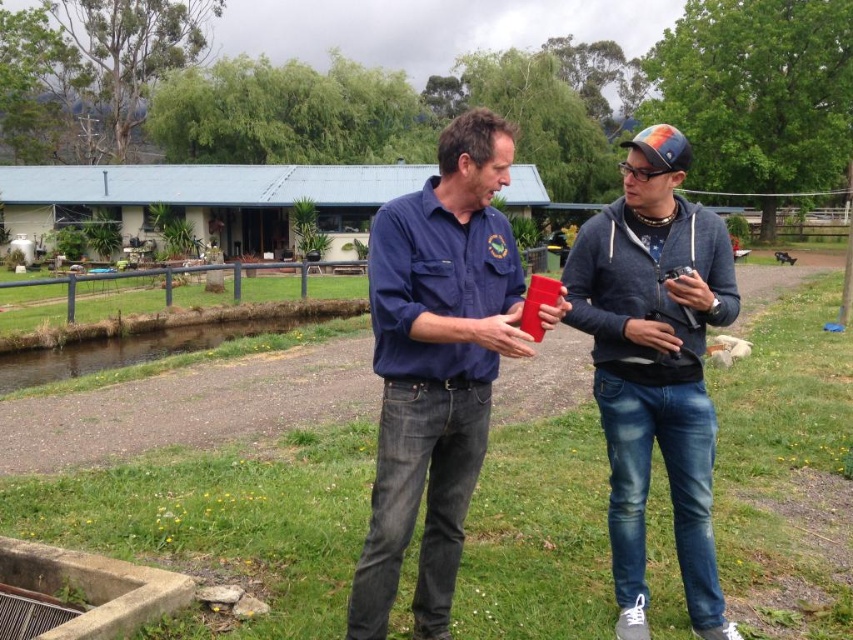
Question: Which of the following is the farthest from the observer?

Choices:
 (A) matte blue shirt at center
 (B) denim jeans at center

Answer: (B)

Question: Which point is closer to the camera?

Choices:
 (A) (419, 284)
 (B) (669, 195)

Answer: (A)

Question: Considering the relative positions of matte blue shirt at center and denim jeans at center in the image provided, where is matte blue shirt at center located with respect to denim jeans at center?

Choices:
 (A) right
 (B) left

Answer: (B)

Question: Does matte blue shirt at center appear over denim jeans at center?

Choices:
 (A) yes
 (B) no

Answer: (B)

Question: Is matte blue shirt at center to the left of denim jeans at center from the viewer's perspective?

Choices:
 (A) yes
 (B) no

Answer: (A)